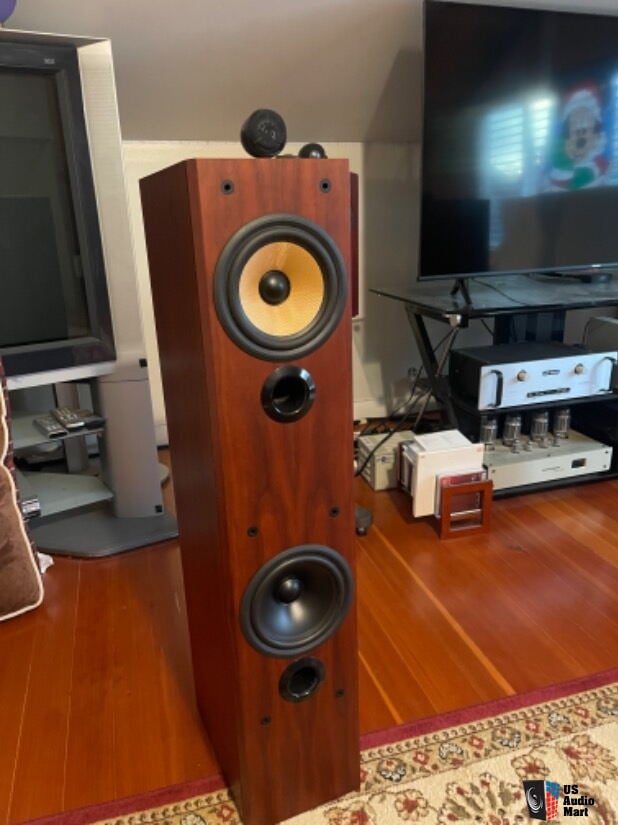
I want to click on ceiling, so click(322, 100).